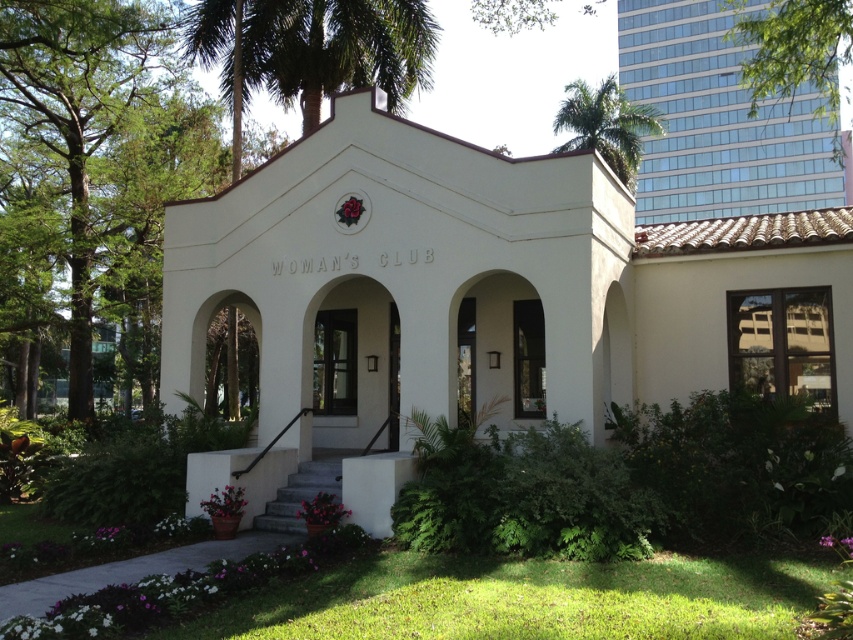
You are a landscape architect planning to install a new bench between the green leafy palm tree at upper center and the green leafy palm tree at upper right. The bench requires a minimum of 20 meters of space between the two trees to be placed comfortably. Based on the scene, will there be enough space for the bench?

The distance between the green leafy palm tree at upper center and the green leafy palm tree at upper right is 24.43 meters, which is more than the required 20 meters. Therefore, there is enough space to comfortably place the bench between them.

You are a landscape architect planning to install a new sprinkler system between the white stucco chapel at center and the green leafy tree at upper right. The sprinkler requires a minimum of 5 meters of space between the two objects to function properly. Based on the distance provided, will the sprinkler system be feasible to install?

The white stucco chapel at center is 8.27 meters away from the green leafy tree at upper right. Since the required minimum distance for the sprinkler system is 5 meters, the 8.27 meters distance is sufficient. Therefore, the sprinkler system can be installed between them.